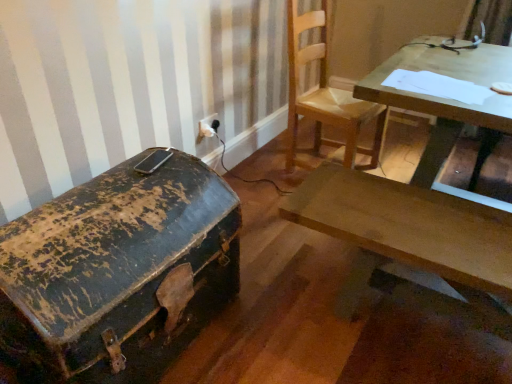
Identify the location of free location to the left of wooden chair at upper center. Image resolution: width=512 pixels, height=384 pixels. (259, 173).